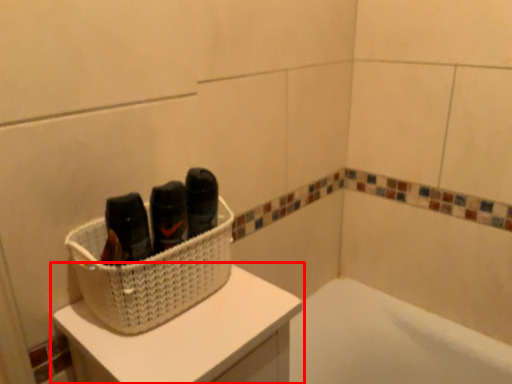
Question: From the image's perspective, what is the correct spatial relationship of furniture (annotated by the red box) in relation to basket?

Choices:
 (A) below
 (B) above

Answer: (A)